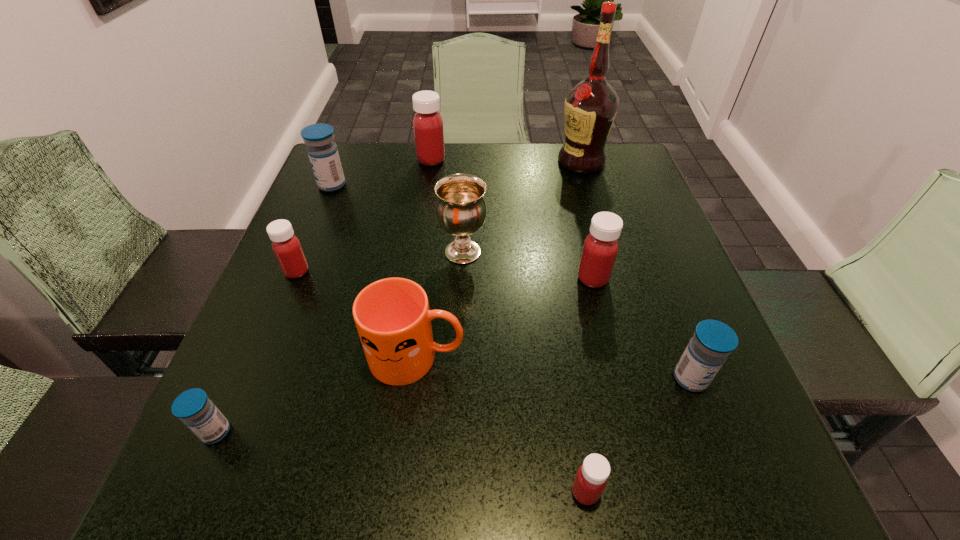
Locate an element on the screen. object identified as the sixth closest to the nearest red medicine is located at coordinates (286, 246).

Locate an element on the screen. medicine that is the fifth closest to the second red medicine from left to right is located at coordinates (195, 409).

This screenshot has height=540, width=960. What are the coordinates of `the seventh closest medicine to the chalice` in the screenshot? It's located at (195, 409).

Locate an element on the screen. The image size is (960, 540). red medicine that stands as the fourth closest to the second farthest medicine is located at coordinates click(591, 478).

Find the location of a particular element. Image resolution: width=960 pixels, height=540 pixels. the closest red medicine relative to the sixth farthest medicine is located at coordinates (286, 246).

In order to click on blue medicine that is the third closest to the second medicine from right to left in this screenshot , I will do `click(195, 409)`.

Identify the location of blue medicine that is the closest to the farthest blue medicine. The width and height of the screenshot is (960, 540). (195, 409).

You are a GUI agent. You are given a task and a screenshot of the screen. Output one action in this format:
    pyautogui.click(x=<x>, y=<y>)
    Task: Click on the free location that satisfies the following two spatial constraints: 1. on the back side of the second nearest object; 2. on the right side of the chalice
    This screenshot has height=540, width=960.
    Given the screenshot: What is the action you would take?
    pyautogui.click(x=294, y=252)

Where is `vacant area in the image that satisfies the following two spatial constraints: 1. on the handle side of the orange mug; 2. on the back side of the third medicine from right to left`? vacant area in the image that satisfies the following two spatial constraints: 1. on the handle side of the orange mug; 2. on the back side of the third medicine from right to left is located at coordinates (400, 492).